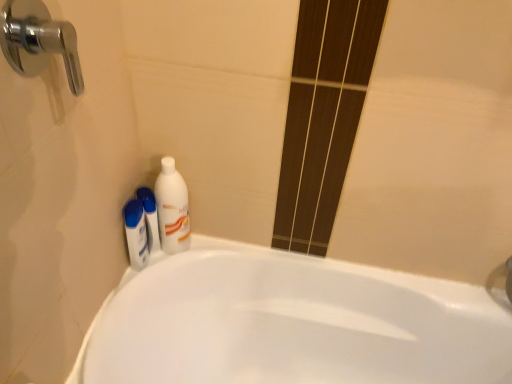
Question: Is white glossy bottle at upper left not within white glossy mouthwash at lower left, marked as the first mouthwash in a left-to-right arrangement?

Choices:
 (A) no
 (B) yes

Answer: (B)

Question: Is white glossy bottle at upper left with white glossy mouthwash at lower left, marked as the 2th mouthwash in a right-to-left arrangement?

Choices:
 (A) yes
 (B) no

Answer: (A)

Question: From the image's perspective, is white glossy bottle at upper left over white glossy mouthwash at lower left, marked as the 2th mouthwash in a right-to-left arrangement?

Choices:
 (A) yes
 (B) no

Answer: (A)

Question: Is the position of white glossy bottle at upper left less distant than that of white glossy mouthwash at lower left, marked as the 2th mouthwash in a right-to-left arrangement?

Choices:
 (A) no
 (B) yes

Answer: (B)

Question: Is white glossy bottle at upper left facing away from white glossy mouthwash at lower left, marked as the 2th mouthwash in a right-to-left arrangement?

Choices:
 (A) yes
 (B) no

Answer: (B)

Question: Is white glossy bottle at upper left bigger than white glossy mouthwash at lower left, marked as the 2th mouthwash in a right-to-left arrangement?

Choices:
 (A) yes
 (B) no

Answer: (A)

Question: Can you confirm if white glossy bottle at lower left, placed as the 2th mouthwash when sorted from left to right, is smaller than chrome metallic faucet at upper left?

Choices:
 (A) yes
 (B) no

Answer: (A)

Question: Is white glossy bottle at lower left, the 1th mouthwash from the right, looking in the opposite direction of chrome metallic faucet at upper left?

Choices:
 (A) no
 (B) yes

Answer: (A)

Question: Does white glossy bottle at lower left, the 1th mouthwash from the right, have a lesser width compared to chrome metallic faucet at upper left?

Choices:
 (A) no
 (B) yes

Answer: (B)

Question: Does white glossy bottle at lower left, the 1th mouthwash from the right, appear on the right side of chrome metallic faucet at upper left?

Choices:
 (A) yes
 (B) no

Answer: (A)

Question: Is white glossy bottle at lower left, placed as the 2th mouthwash when sorted from left to right, positioned beyond the bounds of chrome metallic faucet at upper left?

Choices:
 (A) no
 (B) yes

Answer: (B)

Question: Is white glossy bottle at lower left, the 1th mouthwash from the right, positioned behind chrome metallic faucet at upper left?

Choices:
 (A) no
 (B) yes

Answer: (B)

Question: Is white glossy bathtub at lower left bigger than white glossy bottle at lower left, the 1th mouthwash from the right?

Choices:
 (A) no
 (B) yes

Answer: (B)